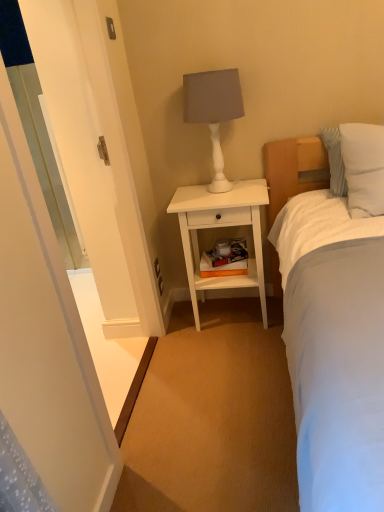
Question: Considering the relative positions of white matte table lamp at upper center and white matte nightstand at center in the image provided, is white matte table lamp at upper center to the left or to the right of white matte nightstand at center?

Choices:
 (A) right
 (B) left

Answer: (B)

Question: Is white matte table lamp at upper center taller or shorter than white matte nightstand at center?

Choices:
 (A) short
 (B) tall

Answer: (A)

Question: Which object is positioned farthest from the white glossy screen door at left?

Choices:
 (A) white soft pillow at upper right
 (B) white matte table lamp at upper center
 (C) white matte nightstand at center

Answer: (A)

Question: Considering the real-world distances, which object is closest to the white glossy screen door at left?

Choices:
 (A) white matte table lamp at upper center
 (B) white matte nightstand at center
 (C) white soft pillow at upper right

Answer: (B)